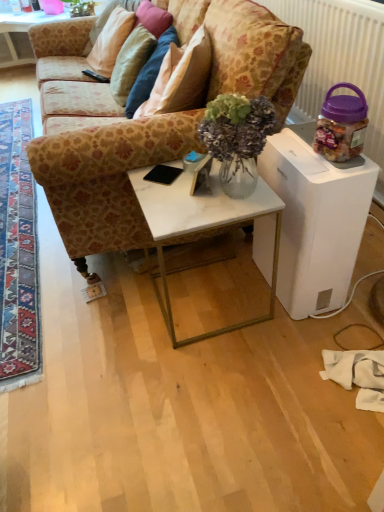
Find the location of a particular element. The height and width of the screenshot is (512, 384). free region under white marble table at center, positioned as the third table in top-to-bottom order (from a real-world perspective) is located at coordinates pos(209,294).